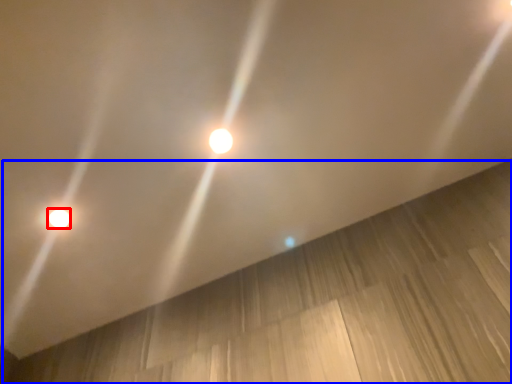
Question: Which point is closer to the camera, lamp (highlighted by a red box) or plywood (highlighted by a blue box)?

Choices:
 (A) lamp
 (B) plywood

Answer: (B)